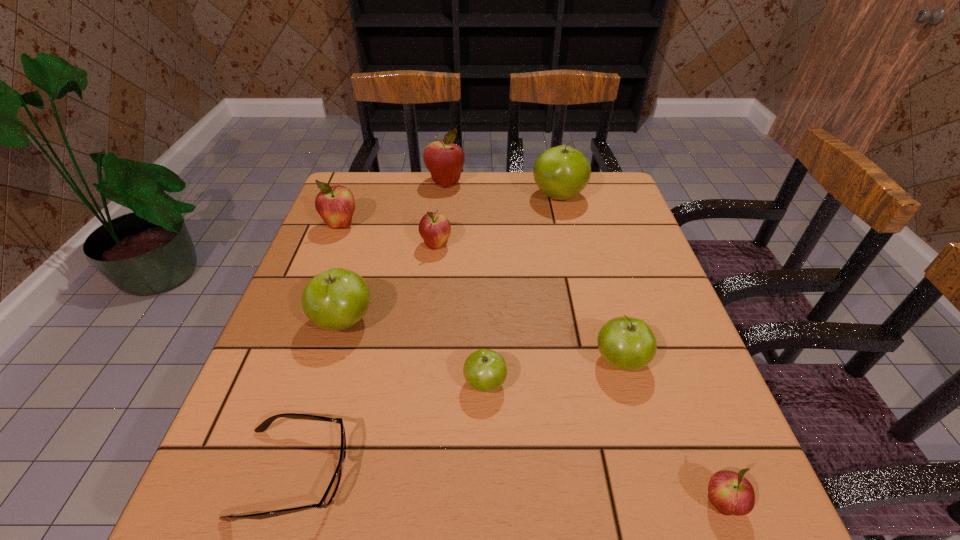
Find the location of a particular element. The width and height of the screenshot is (960, 540). empty space that is in between the smallest red apple and the leftmost green apple is located at coordinates [x=533, y=413].

Locate an element on the screen. The width and height of the screenshot is (960, 540). free spot between the biggest green apple and the second smallest green apple is located at coordinates (589, 279).

Find the location of a particular element. vacant area that lies between the second biggest green apple and the second green apple from left to right is located at coordinates (415, 352).

Identify which object is the eighth closest to the leftmost green apple. Please provide its 2D coordinates. Your answer should be formatted as a tuple, i.e. [(x, y)], where the tuple contains the x and y coordinates of a point satisfying the conditions above.

[(730, 493)]

Identify which object is the seventh closest to the fifth apple from left to right. Please provide its 2D coordinates. Your answer should be formatted as a tuple, i.e. [(x, y)], where the tuple contains the x and y coordinates of a point satisfying the conditions above.

[(562, 172)]

I want to click on apple that is the third nearest to the smallest green apple, so click(730, 493).

The width and height of the screenshot is (960, 540). I want to click on apple object that ranks as the sixth closest to the rightmost red apple, so click(335, 204).

Locate an element on the screen. red apple object that ranks as the closest to the second smallest green apple is located at coordinates (730, 493).

I want to click on red apple that can be found as the second closest to the third biggest red apple, so click(x=444, y=160).

Identify which green apple is the fourth closest to the farthest red apple. Please provide its 2D coordinates. Your answer should be formatted as a tuple, i.e. [(x, y)], where the tuple contains the x and y coordinates of a point satisfying the conditions above.

[(485, 370)]